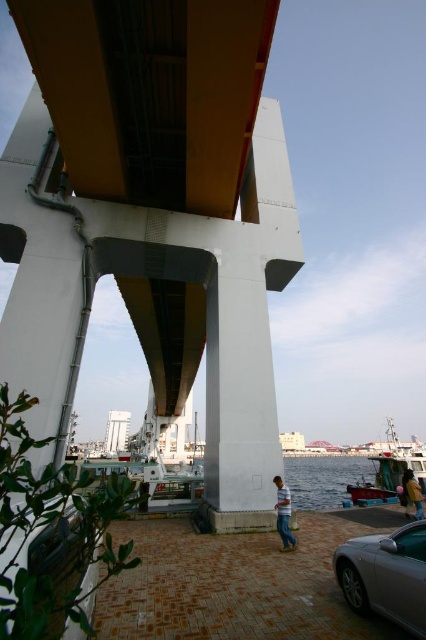
Question: Which object appears closest to the camera in this image?

Choices:
 (A) silver metallic car at lower right
 (B) white smooth concrete pillar at center
 (C) striped cotton shirt at lower center
 (D) dark yellow jacket at lower right

Answer: (A)

Question: Is white smooth concrete pillar at center closer to camera compared to striped cotton shirt at lower center?

Choices:
 (A) yes
 (B) no

Answer: (B)

Question: Can you confirm if silver metallic car at lower right is positioned to the right of striped cotton shirt at lower center?

Choices:
 (A) no
 (B) yes

Answer: (B)

Question: Which object appears farthest from the camera in this image?

Choices:
 (A) silver metallic car at lower right
 (B) striped cotton shirt at lower center
 (C) dark yellow jacket at lower right

Answer: (C)

Question: Estimate the real-world distances between objects in this image. Which object is farther from the white smooth concrete pillar at center?

Choices:
 (A) dark yellow jacket at lower right
 (B) silver metallic car at lower right
 (C) striped cotton shirt at lower center

Answer: (A)

Question: Is white smooth concrete pillar at center positioned in front of silver metallic car at lower right?

Choices:
 (A) no
 (B) yes

Answer: (A)